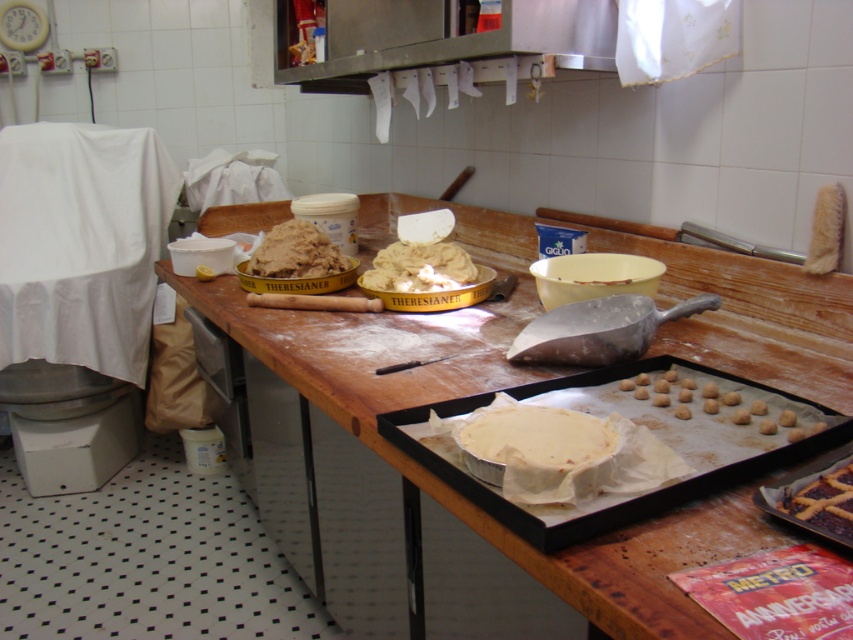
Question: Can you confirm if white matte pie at center is thinner than brown crumbly dough at center?

Choices:
 (A) no
 (B) yes

Answer: (B)

Question: Which object appears closest to the camera in this image?

Choices:
 (A) purple glossy pastry at lower right
 (B) soft dough at center
 (C) white matte pie at center
 (D) matte silver tray at center

Answer: (A)

Question: Which point is closer to the camera?

Choices:
 (A) (308, 461)
 (B) (276, 250)

Answer: (A)

Question: Among these objects, which one is nearest to the camera?

Choices:
 (A) purple glossy pastry at lower right
 (B) brown crumbly dough at center
 (C) white matte pie at center
 (D) matte silver tray at center

Answer: (A)

Question: Does matte silver tray at center appear under brown crumbly dough at center?

Choices:
 (A) yes
 (B) no

Answer: (A)

Question: Is wooden table at center to the right of purple glossy pastry at lower right from the viewer's perspective?

Choices:
 (A) no
 (B) yes

Answer: (A)